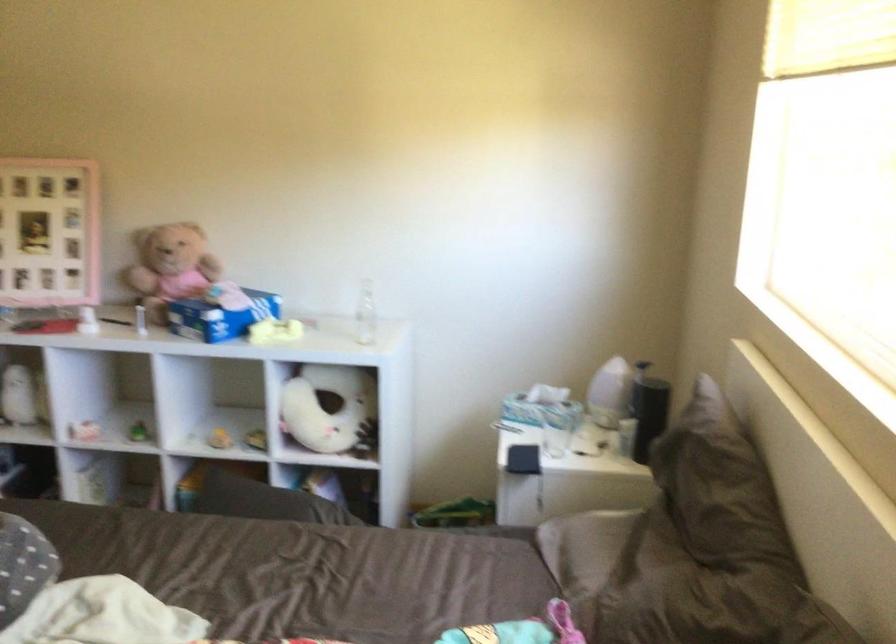
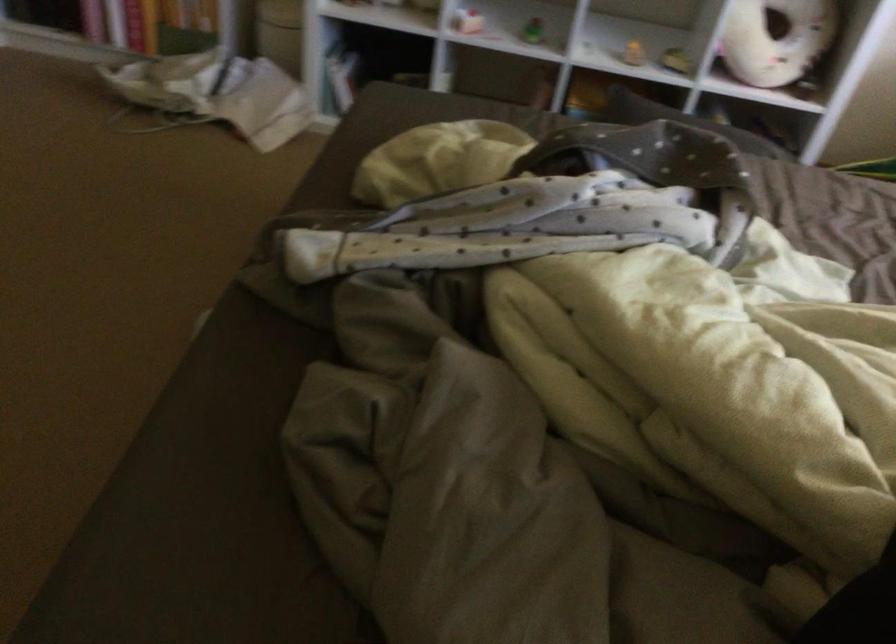
Question: What movement of the cameraman would produce the second image?

Choices:
 (A) Left
 (B) Right
 (C) Forward
 (D) Backward

Answer: (A)